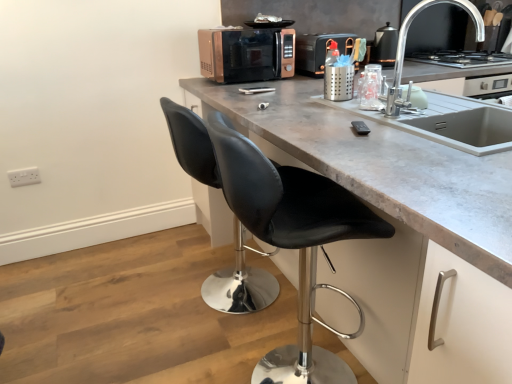
Identify the location of vacant region below black leather swivel chair at center (from a real-world perspective). (217, 295).